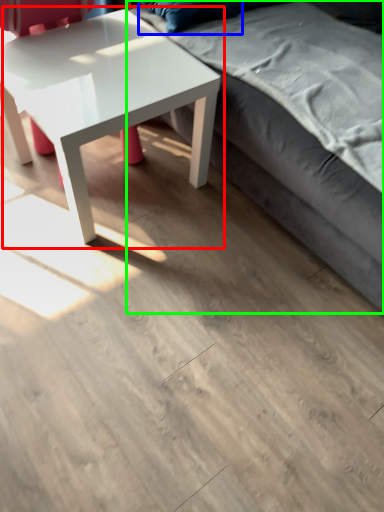
Question: Based on their relative distances, which object is farther from coffee table (highlighted by a red box)? Choose from pillow (highlighted by a blue box) and studio couch (highlighted by a green box).

Choices:
 (A) pillow
 (B) studio couch

Answer: (A)